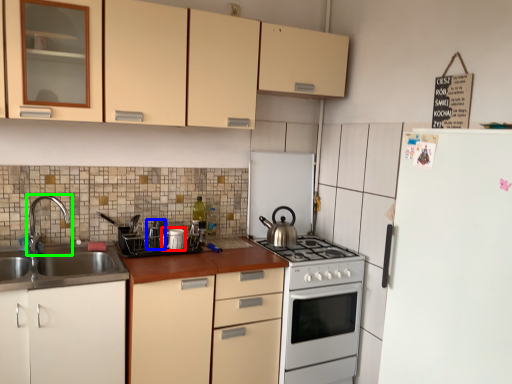
Question: Considering the real-world distances, which object is closest to appliance (highlighted by a red box)? appliance (highlighted by a blue box) or tap (highlighted by a green box).

Choices:
 (A) appliance
 (B) tap

Answer: (A)